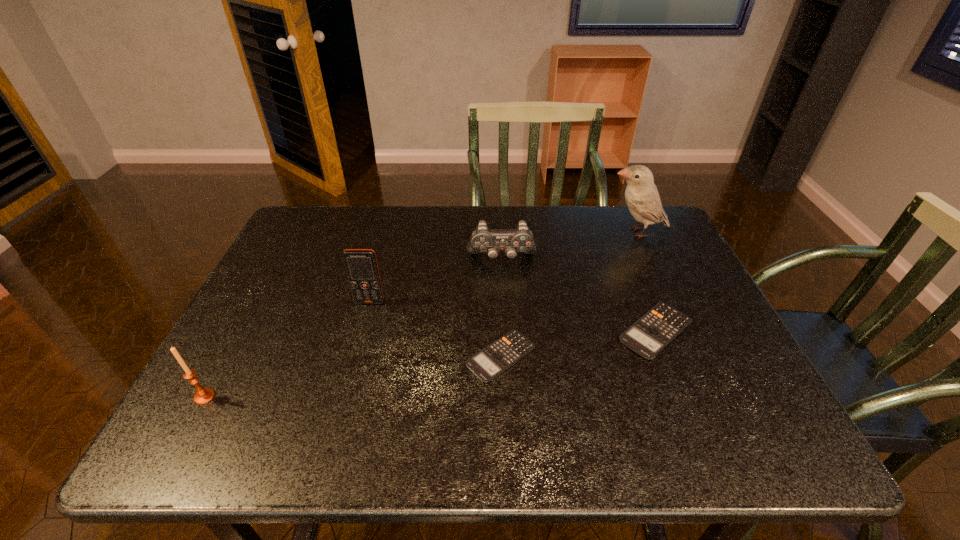
Identify the location of calculator that is at the near edge. This screenshot has width=960, height=540. (494, 359).

At what (x,y) coordinates should I click in order to perform the action: click on candle_holder that is positioned at the near edge. Please return your answer as a coordinate pair (x, y). The width and height of the screenshot is (960, 540). Looking at the image, I should click on (203, 395).

Locate an element on the screen. The width and height of the screenshot is (960, 540). object that is at the left edge is located at coordinates click(203, 395).

This screenshot has height=540, width=960. What are the coordinates of `calculator positioned at the right edge` in the screenshot? It's located at (648, 336).

The height and width of the screenshot is (540, 960). What are the coordinates of `bird that is at the right edge` in the screenshot? It's located at (641, 195).

You are a GUI agent. You are given a task and a screenshot of the screen. Output one action in this format:
    pyautogui.click(x=<x>, y=<y>)
    Task: Click on the object present at the near left corner
    The image size is (960, 540).
    Given the screenshot: What is the action you would take?
    pyautogui.click(x=203, y=395)

You are a GUI agent. You are given a task and a screenshot of the screen. Output one action in this format:
    pyautogui.click(x=<x>, y=<y>)
    Task: Click on the object that is at the far right corner
    The image size is (960, 540).
    Given the screenshot: What is the action you would take?
    pyautogui.click(x=641, y=195)

Where is `free region at the far edge`? free region at the far edge is located at coordinates (473, 226).

At what (x,y) coordinates should I click in order to perform the action: click on free space at the left edge. Please return your answer as a coordinate pair (x, y). This screenshot has height=540, width=960. Looking at the image, I should click on (297, 340).

What are the coordinates of `free space at the right edge of the desktop` in the screenshot? It's located at pos(724,324).